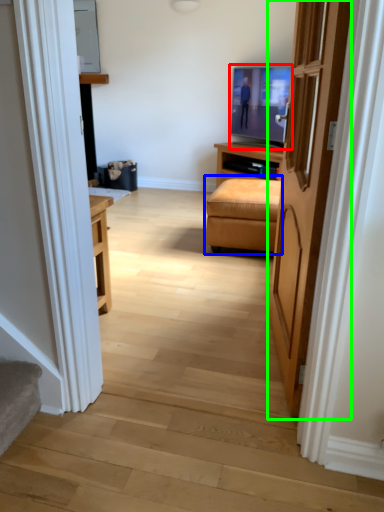
Question: Which object is the closest to the television (highlighted by a red box)? Choose among these: studio couch (highlighted by a blue box) or door (highlighted by a green box).

Choices:
 (A) studio couch
 (B) door

Answer: (A)